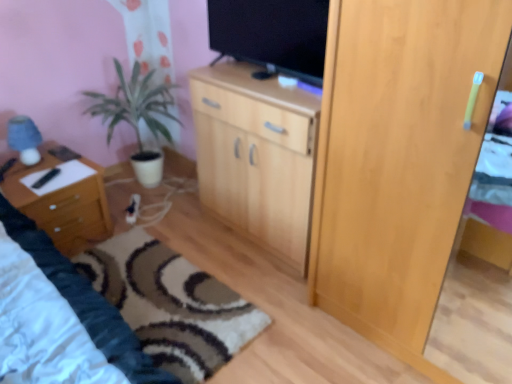
The width and height of the screenshot is (512, 384). Find the location of `free area in between green matte plant at left and carpet with swirl pattern at lower center`. free area in between green matte plant at left and carpet with swirl pattern at lower center is located at coordinates (189, 236).